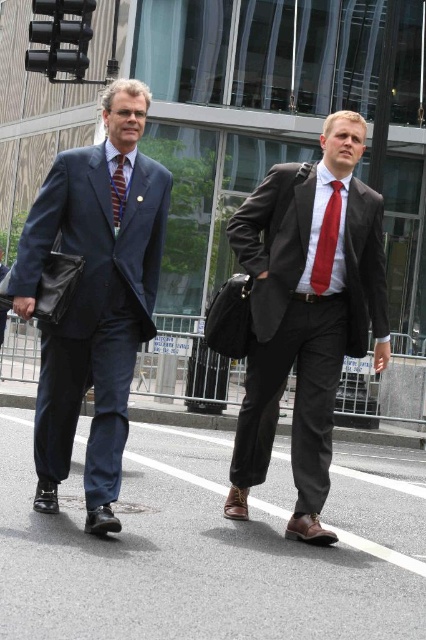
You are a photographer standing 10 feet away from the two individuals in the scene. You want to take a photo of the matte black suit at center and the red satin tie at center. Given that your camera has a maximum focus range of 10 feet, will both objects be in focus?

The distance between the matte black suit at center and the red satin tie at center is 18.16 inches, which is within the same plane since they are both at center. Since both objects are at the same distance from the camera, they will both be in focus within the 10 feet range.